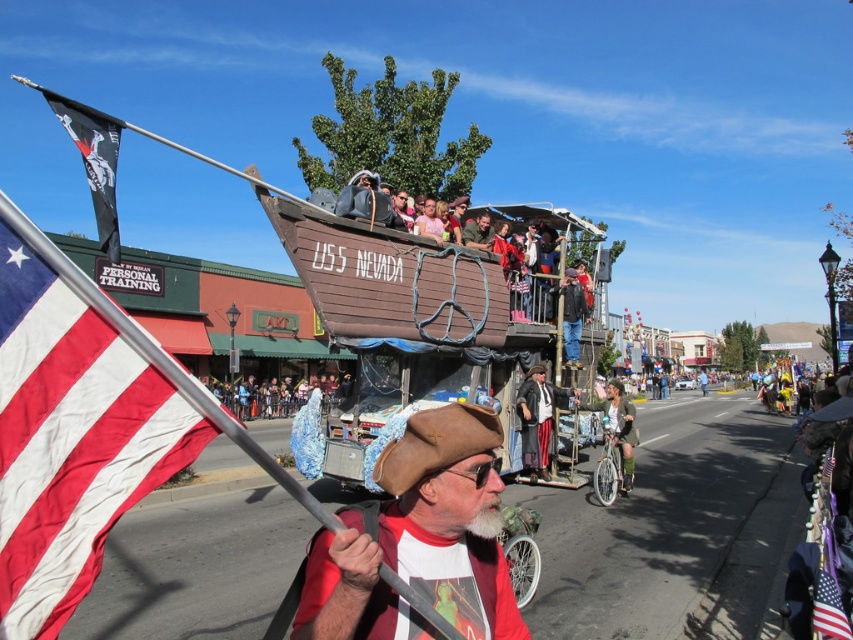
Question: Is brown leather hat at center above shiny black pirate costume at center?

Choices:
 (A) no
 (B) yes

Answer: (B)

Question: Is black fabric pirate flag at upper left below matte brown hat at center?

Choices:
 (A) no
 (B) yes

Answer: (A)

Question: Does black fabric pirate flag at upper left have a smaller size compared to shiny black pirate costume at center?

Choices:
 (A) yes
 (B) no

Answer: (B)

Question: Among these objects, which one is nearest to the camera?

Choices:
 (A) brown leather hat at center
 (B) green fabric jacket at center
 (C) black fabric pirate flag at upper left

Answer: (A)

Question: Which point is farther to the camera?

Choices:
 (A) (300, 397)
 (B) (49, 435)
 (C) (467, 406)

Answer: (A)

Question: Which of the following is the closest to the observer?

Choices:
 (A) blue fabric at center
 (B) american flag at left
 (C) matte brown hat at center
 (D) shiny black pirate costume at center

Answer: (B)